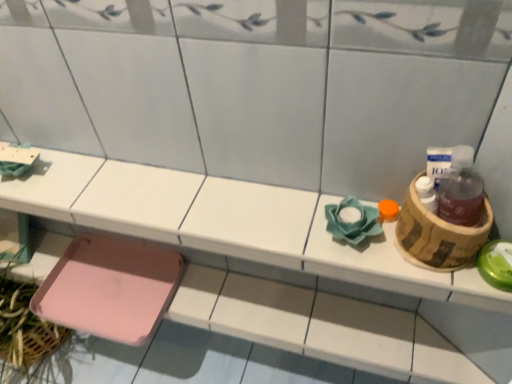
Question: Is the depth of pink plastic tray at lower left greater than that of brown cardboard basket at right?

Choices:
 (A) yes
 (B) no

Answer: (A)

Question: Is pink plastic tray at lower left positioned with its back to brown cardboard basket at right?

Choices:
 (A) no
 (B) yes

Answer: (A)

Question: Is pink plastic tray at lower left thinner than brown cardboard basket at right?

Choices:
 (A) no
 (B) yes

Answer: (A)

Question: Is the depth of pink plastic tray at lower left less than that of brown cardboard basket at right?

Choices:
 (A) yes
 (B) no

Answer: (B)

Question: From a real-world perspective, is pink plastic tray at lower left over brown cardboard basket at right?

Choices:
 (A) no
 (B) yes

Answer: (A)

Question: From a real-world perspective, is brown cardboard basket at right above or below pink plastic step stool at lower left?

Choices:
 (A) above
 (B) below

Answer: (A)

Question: Is brown cardboard basket at right taller or shorter than pink plastic step stool at lower left?

Choices:
 (A) tall
 (B) short

Answer: (A)

Question: In terms of width, does brown cardboard basket at right look wider or thinner when compared to pink plastic step stool at lower left?

Choices:
 (A) wide
 (B) thin

Answer: (B)

Question: In the image, is brown cardboard basket at right on the left side or the right side of pink plastic step stool at lower left?

Choices:
 (A) left
 (B) right

Answer: (B)

Question: Relative to brown cardboard basket at right, is pink plastic tray at lower left in front or behind?

Choices:
 (A) front
 (B) behind

Answer: (B)

Question: Considering the positions of pink plastic tray at lower left and brown cardboard basket at right in the image, is pink plastic tray at lower left wider or thinner than brown cardboard basket at right?

Choices:
 (A) thin
 (B) wide

Answer: (B)

Question: From the image's perspective, is pink plastic tray at lower left positioned above or below brown cardboard basket at right?

Choices:
 (A) above
 (B) below

Answer: (A)

Question: Is pink plastic tray at lower left spatially inside brown cardboard basket at right, or outside of it?

Choices:
 (A) inside
 (B) outside

Answer: (B)

Question: From their relative heights in the image, would you say pink plastic tray at lower left is taller or shorter than pink plastic step stool at lower left?

Choices:
 (A) short
 (B) tall

Answer: (B)

Question: From the image's perspective, is pink plastic tray at lower left positioned above or below pink plastic step stool at lower left?

Choices:
 (A) above
 (B) below

Answer: (A)